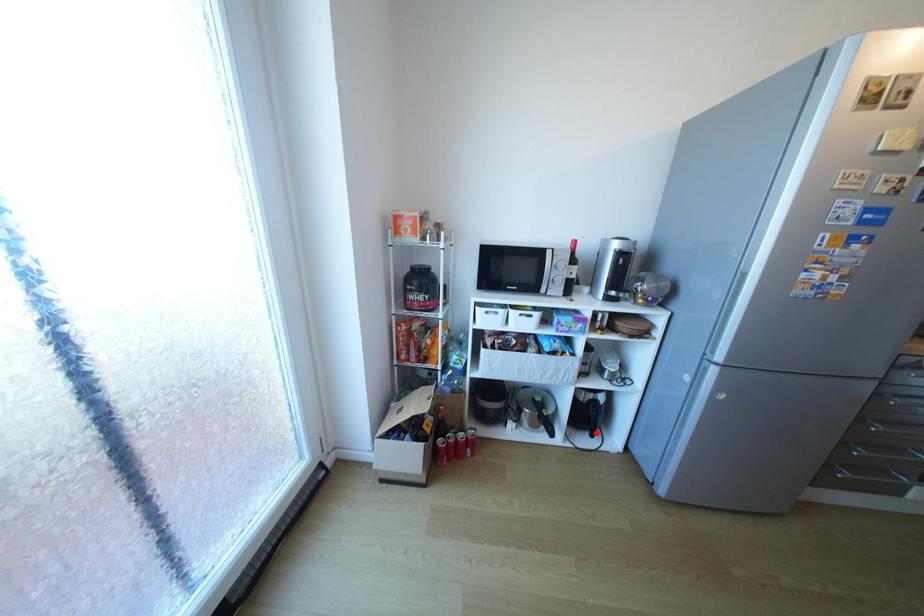
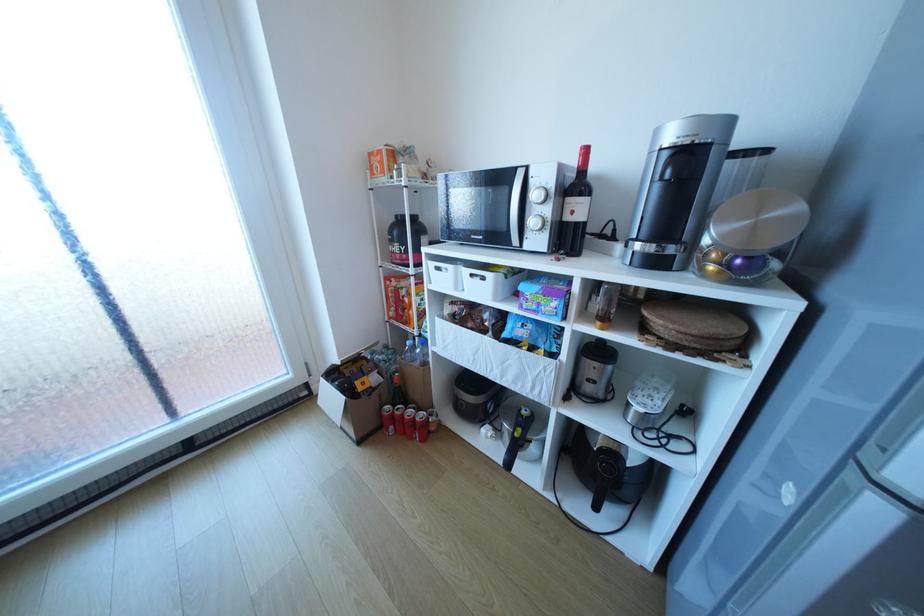
Question: I am providing you with two images of the same scene from different viewpoints. A red point is marked on the first image. At the location where the point appears in image 1, is it still visible in image 2?

Choices:
 (A) Yes
 (B) No

Answer: (A)